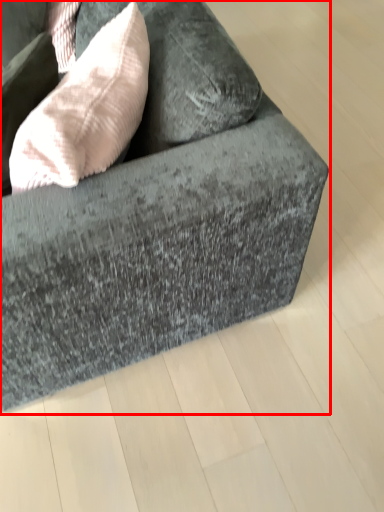
Question: Observing the image, what is the correct spatial positioning of studio couch (annotated by the red box) in reference to throw pillow?

Choices:
 (A) right
 (B) left

Answer: (A)